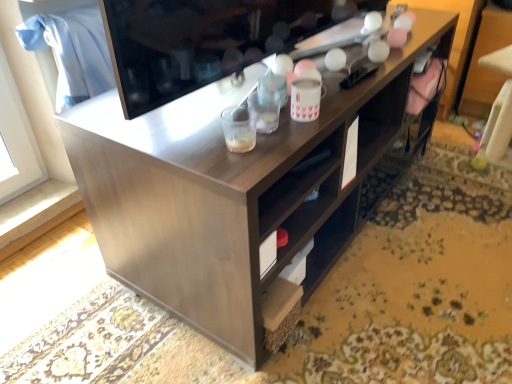
Question: Does translucent plastic cup at center, arranged as the 1th beverage when viewed from the left, have a lesser height compared to white ceramic mug at upper center, the second beverage positioned from the front?

Choices:
 (A) yes
 (B) no

Answer: (A)

Question: Does translucent plastic cup at center, the second beverage when ordered from back to front, appear on the left side of white ceramic mug at upper center, the second beverage positioned from the front?

Choices:
 (A) no
 (B) yes

Answer: (B)

Question: Does translucent plastic cup at center, the second beverage when ordered from back to front, have a smaller size compared to white ceramic mug at upper center, the second beverage positioned from the front?

Choices:
 (A) no
 (B) yes

Answer: (B)

Question: From the image's perspective, is translucent plastic cup at center, the second beverage when ordered from back to front, over white ceramic mug at upper center, arranged as the 1th beverage when viewed from the back?

Choices:
 (A) no
 (B) yes

Answer: (A)

Question: From a real-world perspective, is translucent plastic cup at center, arranged as the 1th beverage when viewed from the left, located beneath white ceramic mug at upper center, the second beverage positioned from the front?

Choices:
 (A) no
 (B) yes

Answer: (B)

Question: Considering the relative sizes of translucent plastic cup at center, the second beverage when ordered from back to front, and white ceramic mug at upper center, the second beverage positioned from the front, in the image provided, is translucent plastic cup at center, the second beverage when ordered from back to front, taller than white ceramic mug at upper center, the second beverage positioned from the front,?

Choices:
 (A) yes
 (B) no

Answer: (B)

Question: Is translucent plastic cup at center, arranged as the 1th beverage when viewed from the left, not close to matte black television at upper center?

Choices:
 (A) yes
 (B) no

Answer: (B)

Question: Is translucent plastic cup at center, the 2th beverage from the right, wider than matte black television at upper center?

Choices:
 (A) no
 (B) yes

Answer: (A)

Question: From the image's perspective, does translucent plastic cup at center, which is counted as the 1th beverage, starting from the front, appear lower than matte black television at upper center?

Choices:
 (A) yes
 (B) no

Answer: (A)

Question: Considering the relative positions of translucent plastic cup at center, arranged as the 1th beverage when viewed from the left, and matte black television at upper center in the image provided, is translucent plastic cup at center, arranged as the 1th beverage when viewed from the left, to the left of matte black television at upper center from the viewer's perspective?

Choices:
 (A) no
 (B) yes

Answer: (A)

Question: From the image's perspective, is translucent plastic cup at center, which is counted as the 1th beverage, starting from the front, on matte black television at upper center?

Choices:
 (A) yes
 (B) no

Answer: (B)

Question: Can you confirm if translucent plastic cup at center, arranged as the 1th beverage when viewed from the left, is taller than matte black television at upper center?

Choices:
 (A) no
 (B) yes

Answer: (A)

Question: Is matte black television at upper center outside translucent plastic cup at center, the 2th beverage from the right?

Choices:
 (A) no
 (B) yes

Answer: (B)